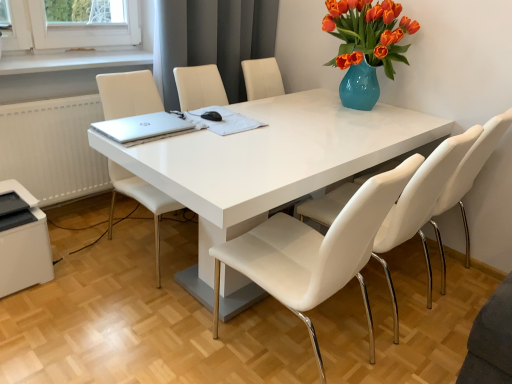
You are a GUI agent. You are given a task and a screenshot of the screen. Output one action in this format:
    pyautogui.click(x=<x>, y=<y>)
    Task: Click on the vacant position to the left of white leather chair at center, acting as the third chair starting from the right
    Image resolution: width=512 pixels, height=384 pixels.
    Given the screenshot: What is the action you would take?
    pyautogui.click(x=87, y=247)